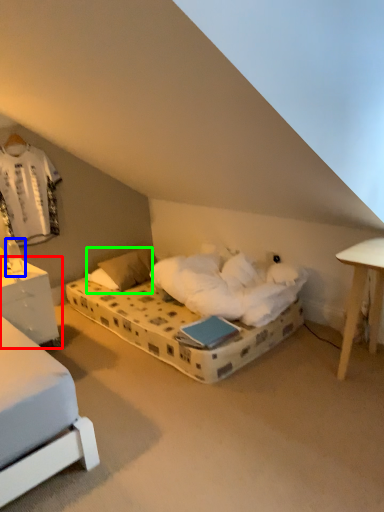
Question: Which is farther away from nightstand (highlighted by a red box)? table lamp (highlighted by a blue box) or pillow (highlighted by a green box)?

Choices:
 (A) table lamp
 (B) pillow

Answer: (B)